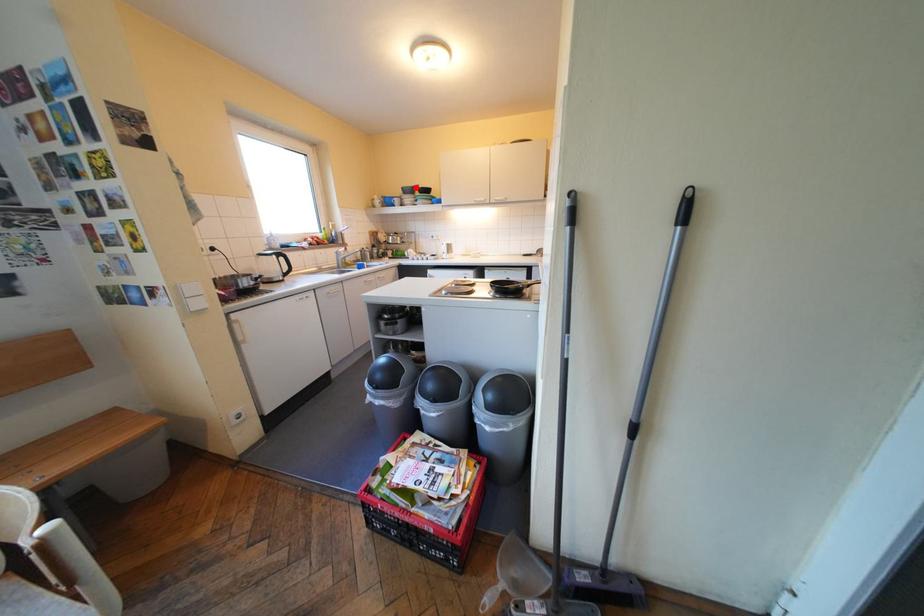
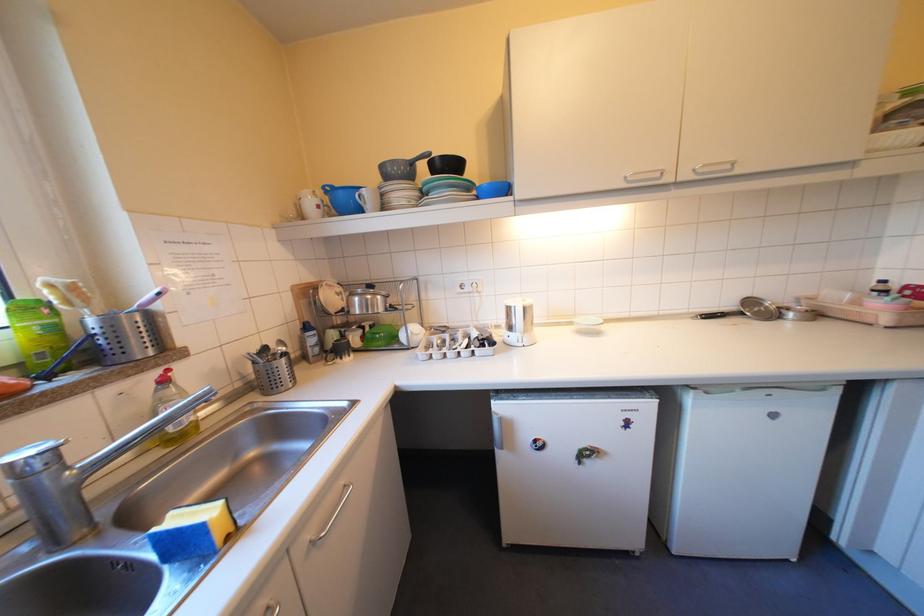
Find the pixel in the second image that matches the highlighted location in the first image.

(395, 167)